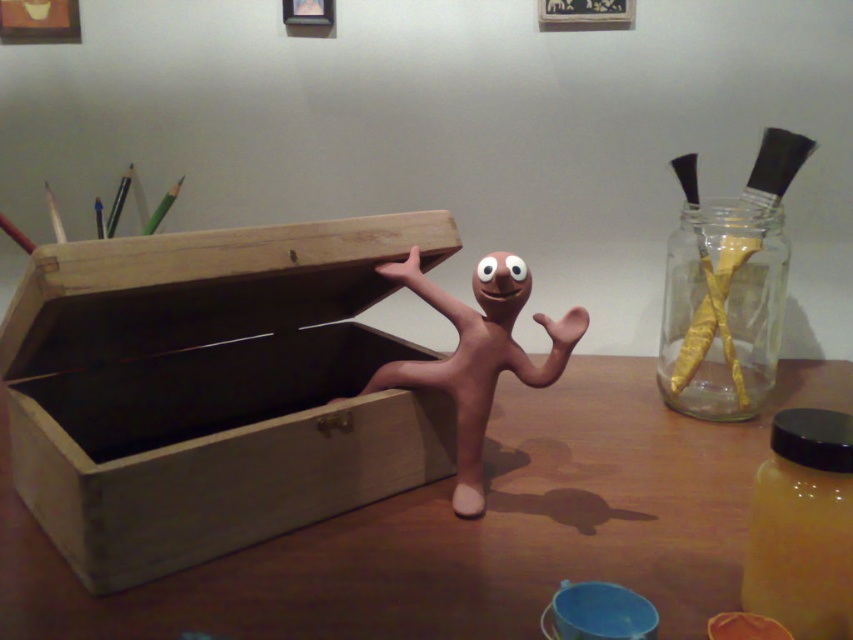
Can you confirm if brown wooden table at center is thinner than matte clay figure at center?

Incorrect, brown wooden table at center's width is not less than matte clay figure at center's.

Can you confirm if brown wooden table at center is positioned above matte clay figure at center?

No, brown wooden table at center is not above matte clay figure at center.

Does point (456, 525) come behind point (531, 288)?

That is False.

The width and height of the screenshot is (853, 640). What are the coordinates of `brown wooden table at center` in the screenshot? It's located at (469, 531).

Image resolution: width=853 pixels, height=640 pixels. What do you see at coordinates (727, 288) in the screenshot?
I see `gold foil wrapped at right` at bounding box center [727, 288].

Does gold foil wrapped at right have a lesser width compared to matte clay figure at center?

Yes.

Between point (691, 372) and point (396, 372), which one is positioned behind?

Point (691, 372)

This screenshot has height=640, width=853. I want to click on gold foil wrapped at right, so click(x=727, y=288).

Who is more forward, (163,282) or (780,225)?

Positioned in front is point (163,282).

Can you confirm if wooden box at center is taller than gold foil wrapped at right?

No.

Who is more forward, (432, 396) or (778, 182)?

Positioned in front is point (432, 396).

Where is `wooden box at center`? wooden box at center is located at coordinates (212, 388).